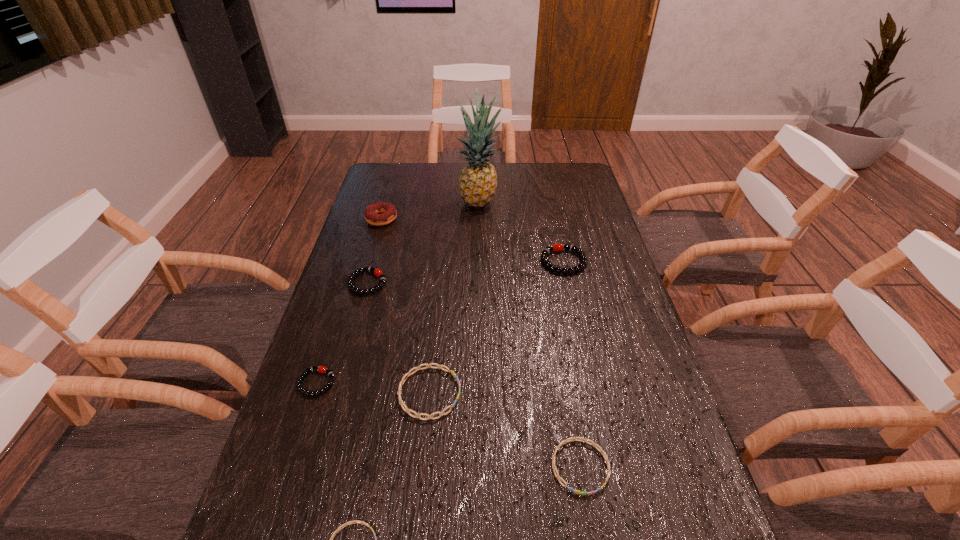
Locate an element on the screen. The width and height of the screenshot is (960, 540). free space located on the front of the yellow pineapple is located at coordinates (479, 256).

Where is `vacant space located on the right of the second tallest object`? vacant space located on the right of the second tallest object is located at coordinates (450, 219).

You are a GUI agent. You are given a task and a screenshot of the screen. Output one action in this format:
    pyautogui.click(x=<x>, y=<y>)
    Task: Click on the free location located on the left of the rightmost black bracelet
    This screenshot has height=540, width=960.
    Given the screenshot: What is the action you would take?
    pyautogui.click(x=524, y=261)

The height and width of the screenshot is (540, 960). I want to click on free space located 0.350m on the surface of the biggest blue bracelet showing star-shaped elements, so click(608, 393).

The image size is (960, 540). I want to click on vacant point located on the back of the second smallest black bracelet, so click(x=376, y=252).

The width and height of the screenshot is (960, 540). In order to click on free point located on the surface of the second smallest blue bracelet showing star-shaped elements in this screenshot , I will do `click(592, 535)`.

Where is `free region located on the right of the nearest black bracelet`? Image resolution: width=960 pixels, height=540 pixels. free region located on the right of the nearest black bracelet is located at coordinates (385, 383).

This screenshot has height=540, width=960. In order to click on object located at the far edge in this screenshot , I will do `click(478, 180)`.

Image resolution: width=960 pixels, height=540 pixels. I want to click on doughnut at the left edge, so click(x=372, y=214).

In order to click on object present at the right edge in this screenshot , I will do `click(555, 247)`.